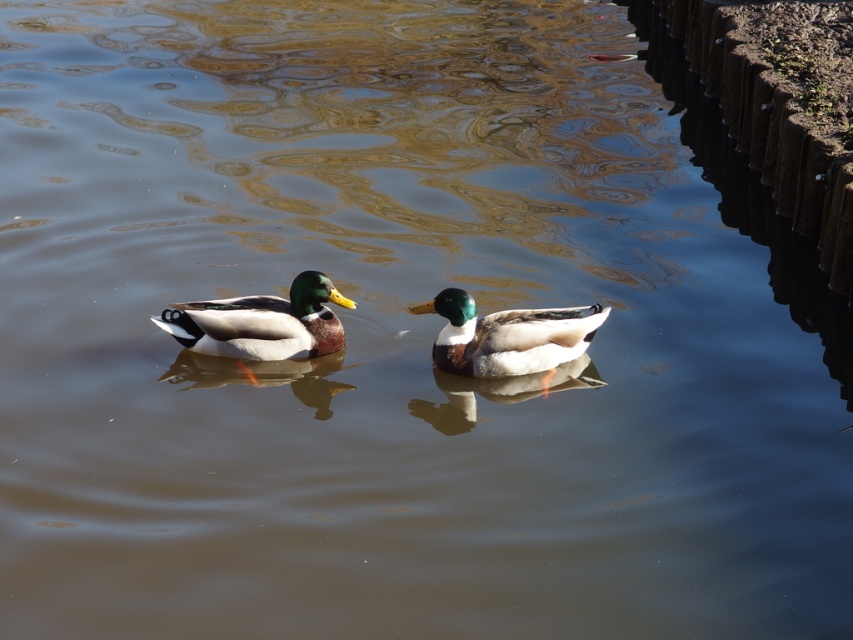
Who is more forward, (302,292) or (490,337)?

Point (490,337) is in front.

Is shiny green duck at center taller than shiny brown duck at center?

Yes.

This screenshot has height=640, width=853. Find the location of `shiny green duck at center`. shiny green duck at center is located at coordinates (260, 323).